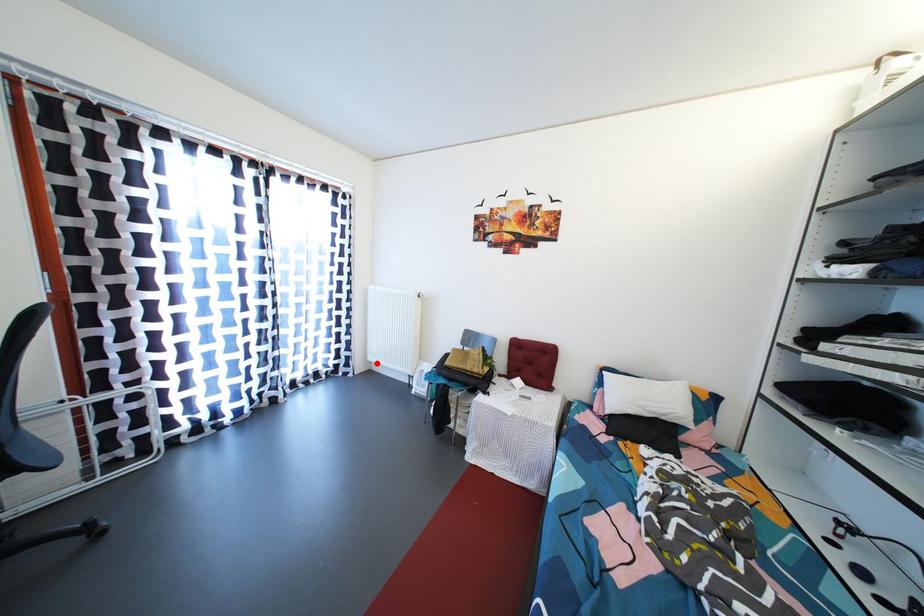
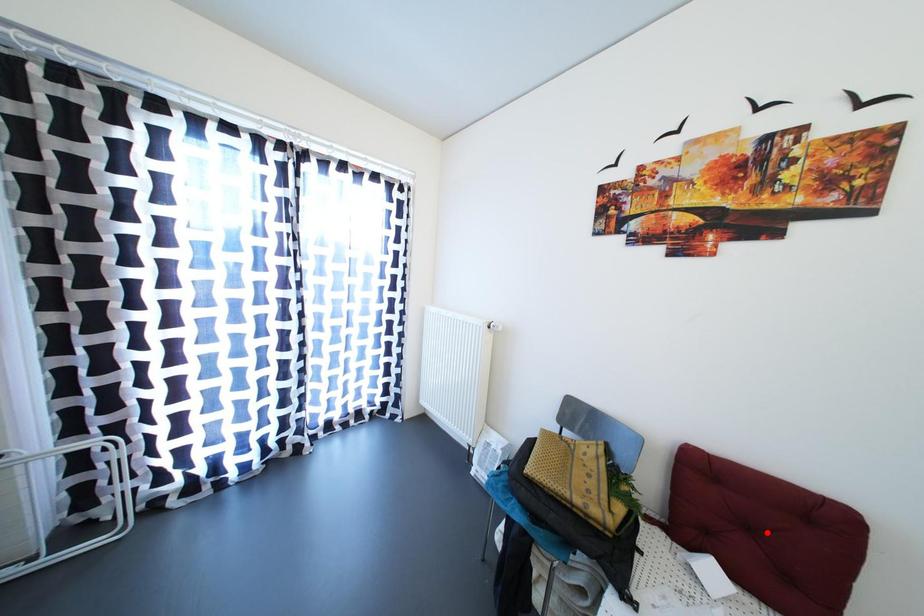
I am providing you with two images of the same scene from different viewpoints. A red point is marked on the first image and another point is marked on the second image. Are the points marked in image1 and image2 representing the same 3D position?

No